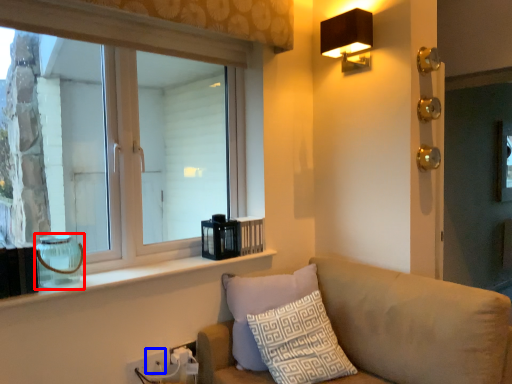
Question: Among these objects, which one is nearest to the camera, glass vase (highlighted by a red box) or electric outlet (highlighted by a blue box)?

Choices:
 (A) glass vase
 (B) electric outlet

Answer: (A)